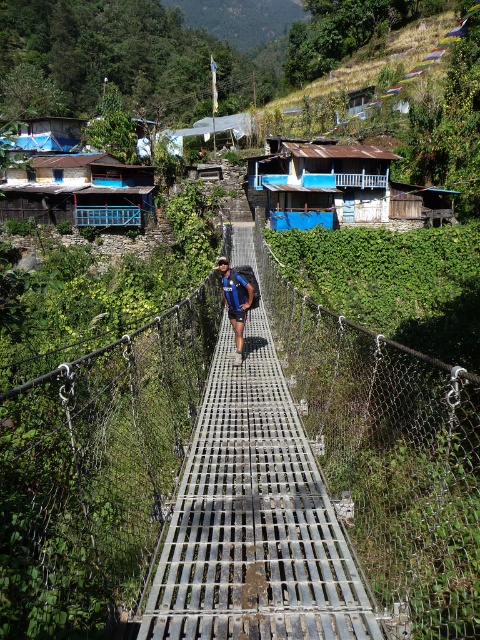
You are a delivery person carrying a package that requires a clear path between the metal grating bridge at center and the rusty metal hut at center. The package can only be transported if the distance between them is at least 25 meters. Based on the scene, can you confirm if the distance meets the requirement?

The metal grating bridge at center and the rusty metal hut at center are 28.00 meters apart from each other, which exceeds the minimum required distance of 25 meters. Therefore, the package can be safely transported between them.

You are a hiker carrying a blue fabric backpack at center and standing on the metal grating bridge at center. Can you safely walk across the bridge while carrying the backpack?

The metal grating bridge at center might be wider than the blue fabric backpack at center, so it is likely safe to walk across as the bridge can accommodate the backpack width.